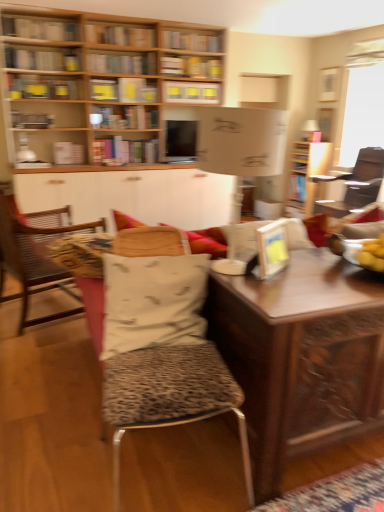
Question: Can you confirm if metallic silver bookshelf at upper left, acting as the second book starting from the bottom, is wider than hardcover book at upper center, the 3th book viewed from the top?

Choices:
 (A) no
 (B) yes

Answer: (A)

Question: Is metallic silver bookshelf at upper left, acting as the second book starting from the bottom, far from hardcover book at upper center, the seventh book from the bottom?

Choices:
 (A) yes
 (B) no

Answer: (A)

Question: Is metallic silver bookshelf at upper left, acting as the second book starting from the bottom, positioned behind hardcover book at upper center, the seventh book from the bottom?

Choices:
 (A) yes
 (B) no

Answer: (B)

Question: Does metallic silver bookshelf at upper left, the eighth book viewed from the top, contain hardcover book at upper center, the seventh book from the bottom?

Choices:
 (A) yes
 (B) no

Answer: (B)

Question: Can you confirm if metallic silver bookshelf at upper left, the eighth book viewed from the top, is thinner than hardcover book at upper center, the seventh book from the bottom?

Choices:
 (A) yes
 (B) no

Answer: (A)

Question: In terms of size, does white fabric pillow at center appear bigger or smaller than wooden bookcase at upper left?

Choices:
 (A) big
 (B) small

Answer: (B)

Question: Considering the positions of white fabric pillow at center and wooden bookcase at upper left in the image, is white fabric pillow at center taller or shorter than wooden bookcase at upper left?

Choices:
 (A) tall
 (B) short

Answer: (B)

Question: Is point (198, 308) positioned closer to the camera than point (155, 68)?

Choices:
 (A) closer
 (B) farther

Answer: (A)

Question: Is white fabric pillow at center wider or thinner than wooden bookcase at upper left?

Choices:
 (A) wide
 (B) thin

Answer: (B)

Question: From the image's perspective, is wooden table at center above or below wooden bookshelf at upper center, the 8th book from the bottom?

Choices:
 (A) above
 (B) below

Answer: (B)

Question: From a real-world perspective, relative to wooden bookshelf at upper center, the 8th book from the bottom, is wooden table at center vertically above or below?

Choices:
 (A) above
 (B) below

Answer: (B)

Question: Is wooden table at center inside or outside of wooden bookshelf at upper center, marked as the 2th book in a top-to-bottom arrangement?

Choices:
 (A) outside
 (B) inside

Answer: (A)

Question: Is point (327, 370) closer or farther from the camera than point (125, 39)?

Choices:
 (A) farther
 (B) closer

Answer: (B)

Question: Is metallic silver bookshelf at upper left, acting as the second book starting from the bottom, wider or thinner than leopard print cushion at left?

Choices:
 (A) wide
 (B) thin

Answer: (B)

Question: From the image's perspective, relative to leopard print cushion at left, is metallic silver bookshelf at upper left, the eighth book viewed from the top, above or below?

Choices:
 (A) below
 (B) above

Answer: (B)